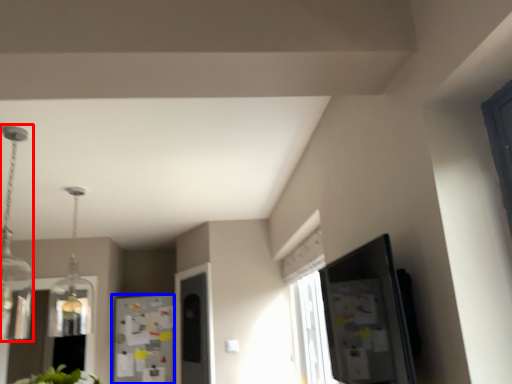
Question: Which object is closer to the camera taking this photo, light fixture (highlighted by a red box) or fridge (highlighted by a blue box)?

Choices:
 (A) light fixture
 (B) fridge

Answer: (A)